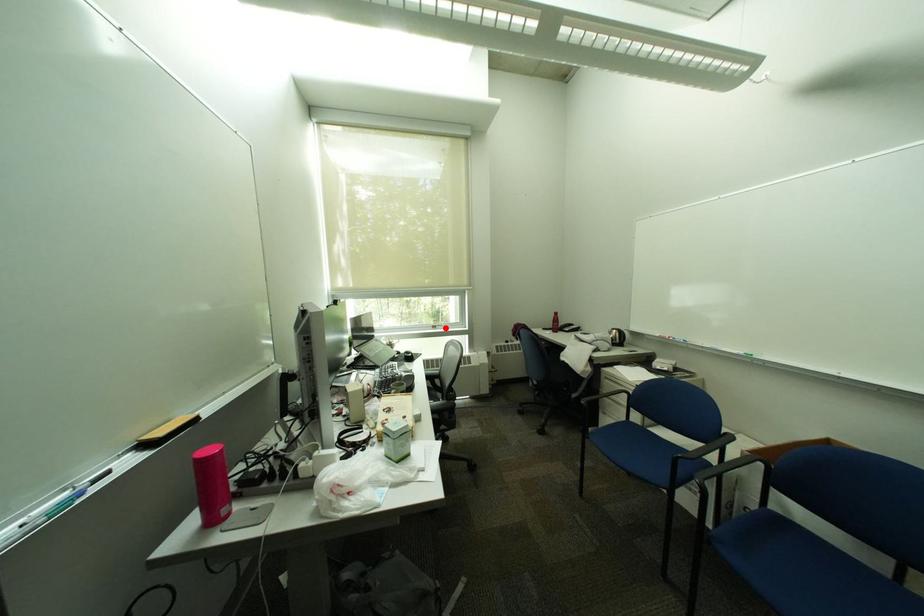
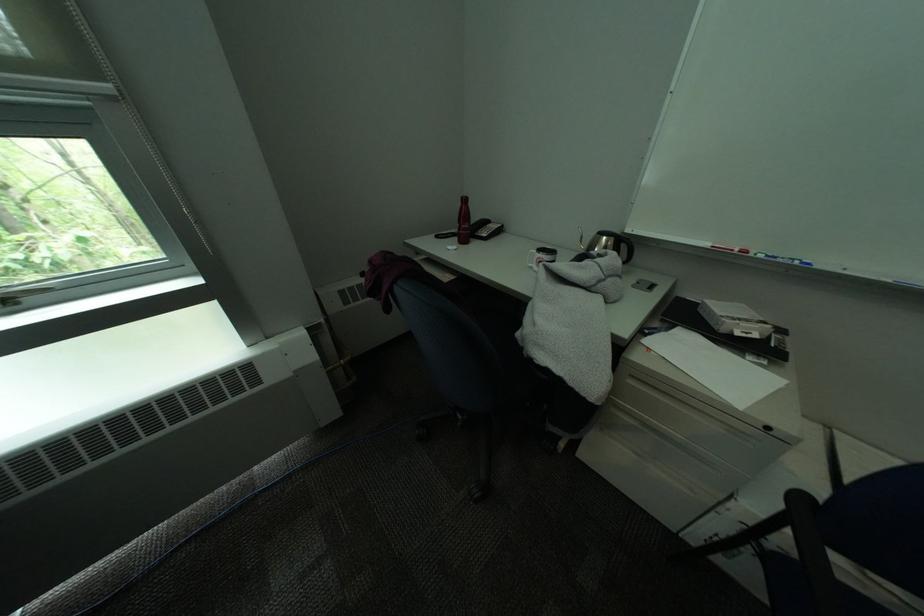
The point at the highlighted location is marked in the first image. Where is the corresponding point in the second image?

(15, 302)